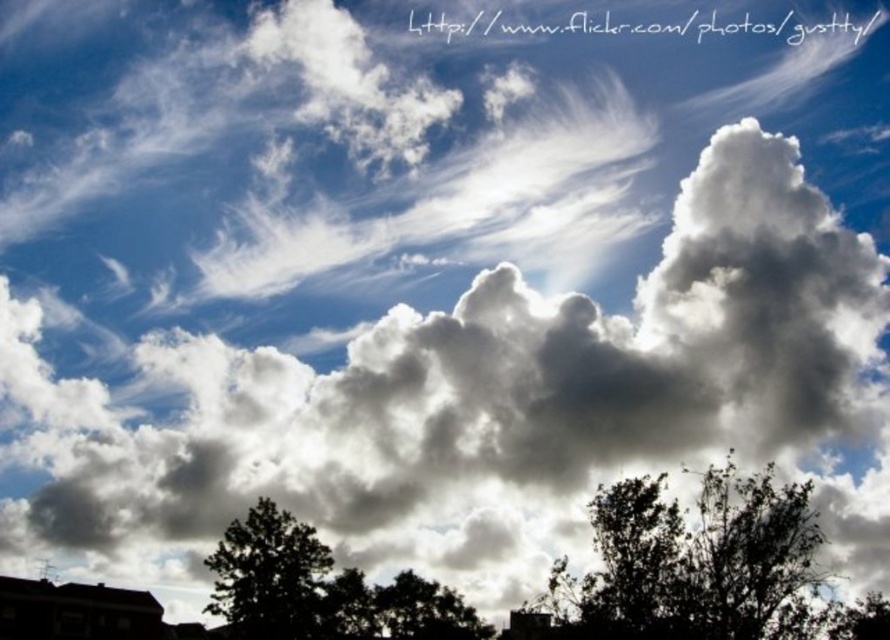
Does dark green leafy tree at lower center have a larger size compared to dark green leafy tree at lower left?

Correct, dark green leafy tree at lower center is larger in size than dark green leafy tree at lower left.

Image resolution: width=890 pixels, height=640 pixels. I want to click on dark green leafy tree at lower center, so click(694, 563).

Is dark green leafy tree at lower left closer to camera compared to green leafy tree at lower right?

No, dark green leafy tree at lower left is behind green leafy tree at lower right.

Is dark green leafy tree at lower left bigger than green leafy tree at lower right?

Yes, dark green leafy tree at lower left is bigger than green leafy tree at lower right.

Does point (233, 580) lie in front of point (878, 618)?

No, (233, 580) is further to viewer.

The width and height of the screenshot is (890, 640). I want to click on dark green leafy tree at lower left, so click(269, 577).

How much distance is there between green leafy tree at lower center and green leafy tree at lower right?

A distance of 117.15 meters exists between green leafy tree at lower center and green leafy tree at lower right.

Locate an element on the screen. green leafy tree at lower center is located at coordinates (425, 611).

Consider the image. Who is more distant from viewer, (426, 609) or (859, 616)?

Point (426, 609)

Find the location of a particular element. green leafy tree at lower center is located at coordinates (425, 611).